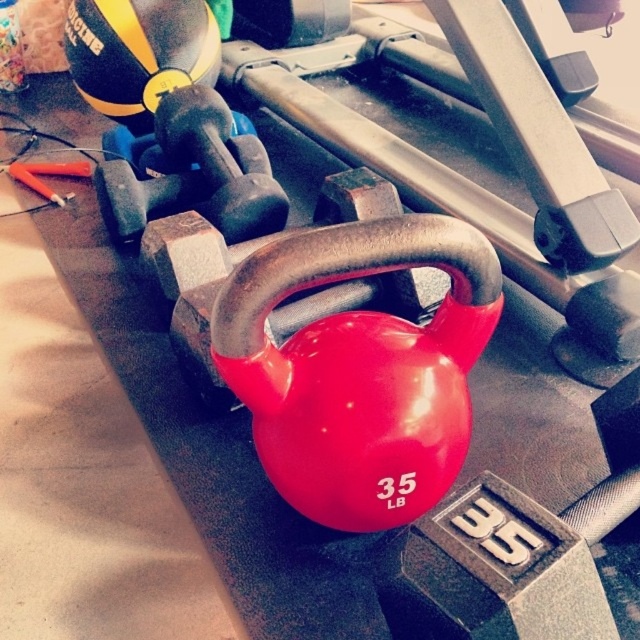
Who is more distant from viewer, (273, 452) or (177, 186)?

The point (177, 186) is more distant.

Image resolution: width=640 pixels, height=640 pixels. I want to click on rubberized red kettlebell at center, so click(x=358, y=369).